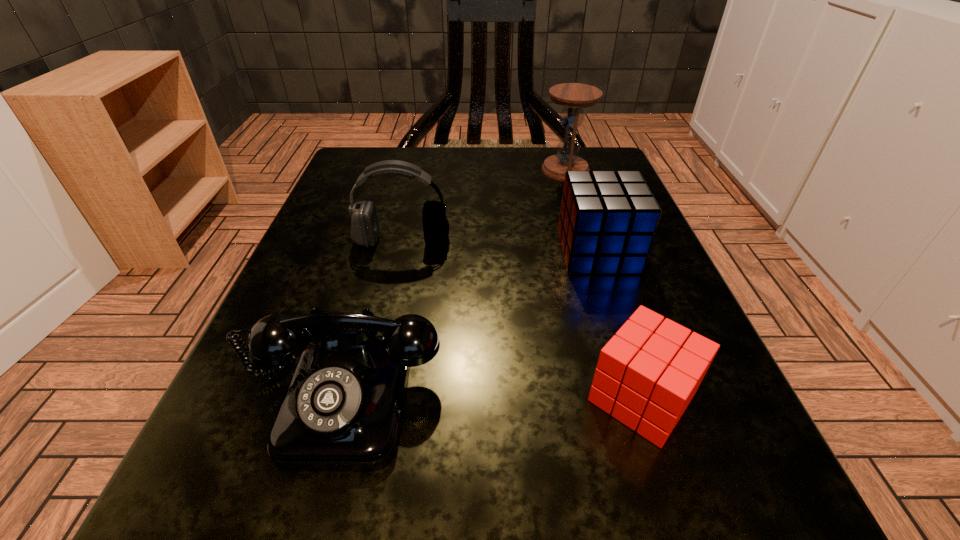
Where is `vacant point located between the telephone and the farther cube`? The width and height of the screenshot is (960, 540). vacant point located between the telephone and the farther cube is located at coordinates (470, 322).

The image size is (960, 540). Identify the location of object that is the third nearest to the shortest object. (364, 223).

Locate an element on the screen. The height and width of the screenshot is (540, 960). object that is the second closest to the headset is located at coordinates (342, 411).

Image resolution: width=960 pixels, height=540 pixels. I want to click on free space that satisfies the following two spatial constraints: 1. on the headband of the nearer cube; 2. on the right side of the headset, so click(x=367, y=398).

Locate an element on the screen. Image resolution: width=960 pixels, height=540 pixels. free space that satisfies the following two spatial constraints: 1. on the back side of the farther cube; 2. on the left side of the nearer cube is located at coordinates (594, 252).

I want to click on free space that satisfies the following two spatial constraints: 1. on the headband of the shortest object; 2. on the right side of the headset, so click(367, 398).

At what (x,y) coordinates should I click in order to perform the action: click on free location that satisfies the following two spatial constraints: 1. on the dial of the nearer cube; 2. on the left side of the telephone. Please return your answer as a coordinate pair (x, y). This screenshot has width=960, height=540. Looking at the image, I should click on (341, 398).

Where is `free location that satisfies the following two spatial constraints: 1. on the dial of the telephone; 2. on the right side of the shorter cube`? The height and width of the screenshot is (540, 960). free location that satisfies the following two spatial constraints: 1. on the dial of the telephone; 2. on the right side of the shorter cube is located at coordinates (341, 398).

At what (x,y) coordinates should I click in order to perform the action: click on free spot that satisfies the following two spatial constraints: 1. on the headband of the headset; 2. on the left side of the farther cube. Please return your answer as a coordinate pair (x, y). Looking at the image, I should click on (399, 252).